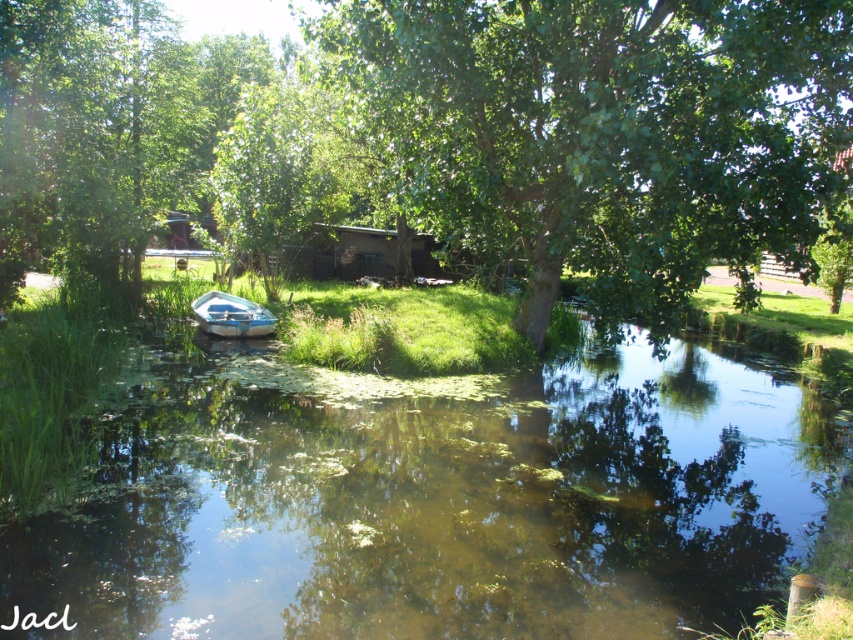
Question: Which object is farther from the camera taking this photo?

Choices:
 (A) green leafy tree at center
 (B) white plastic boat at center
 (C) green algae-covered water at center

Answer: (B)

Question: Does green leafy tree at center have a larger size compared to white plastic boat at center?

Choices:
 (A) no
 (B) yes

Answer: (B)

Question: Which of these objects is positioned farthest from the green leafy tree at center?

Choices:
 (A) green algae-covered water at center
 (B) white plastic boat at center

Answer: (B)

Question: Observing the image, what is the correct spatial positioning of green algae-covered water at center in reference to green leafy tree at center?

Choices:
 (A) right
 (B) left

Answer: (B)

Question: Which object is farther from the camera taking this photo?

Choices:
 (A) green leafy tree at center
 (B) white plastic boat at center

Answer: (B)

Question: Can you confirm if green algae-covered water at center is bigger than green leafy tree at center?

Choices:
 (A) yes
 (B) no

Answer: (A)